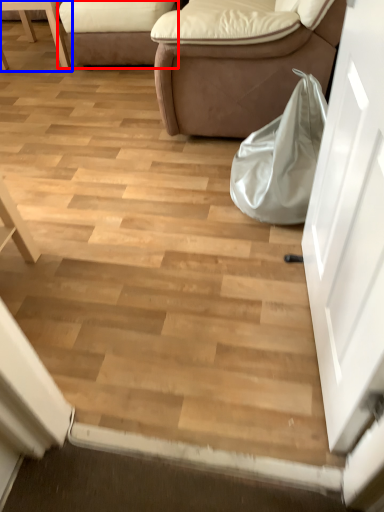
Question: Which point is further to the camera, studio couch (highlighted by a red box) or furniture (highlighted by a blue box)?

Choices:
 (A) studio couch
 (B) furniture

Answer: (B)